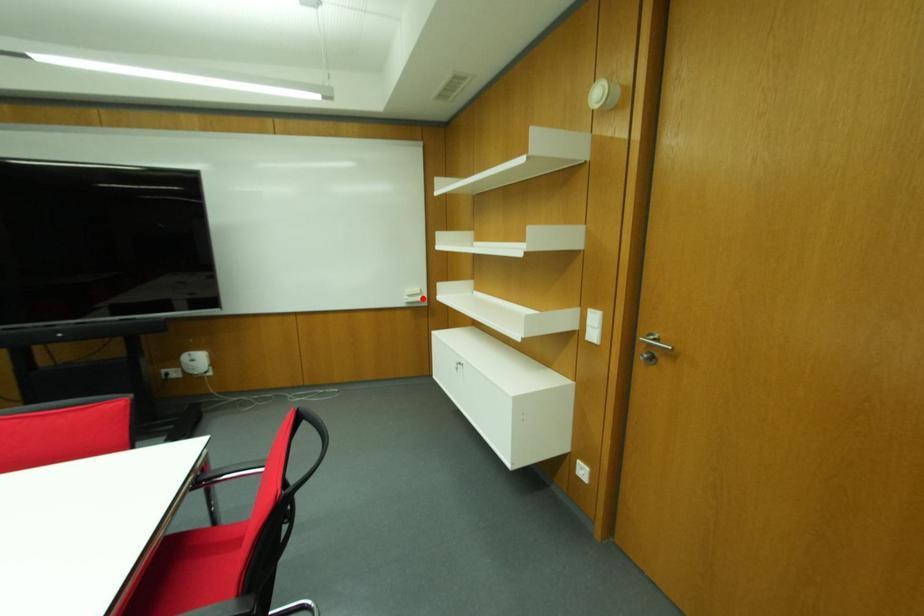
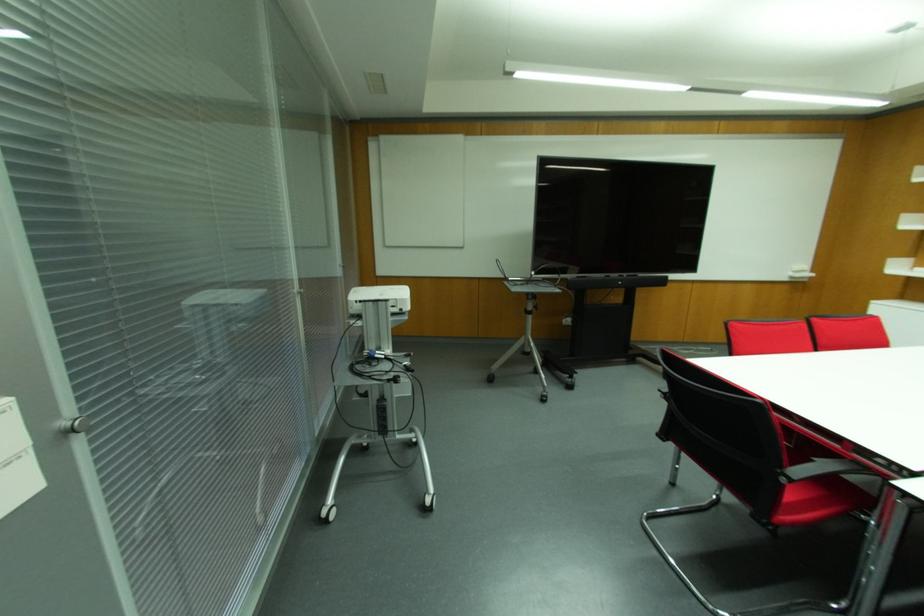
Question: A red point is marked in image1. In image2, is the corresponding 3D point closer to the camera or farther? Reply with the corresponding letter.

Choices:
 (A) The corresponding 3D point is closer.
 (B) The corresponding 3D point is farther.

Answer: (B)